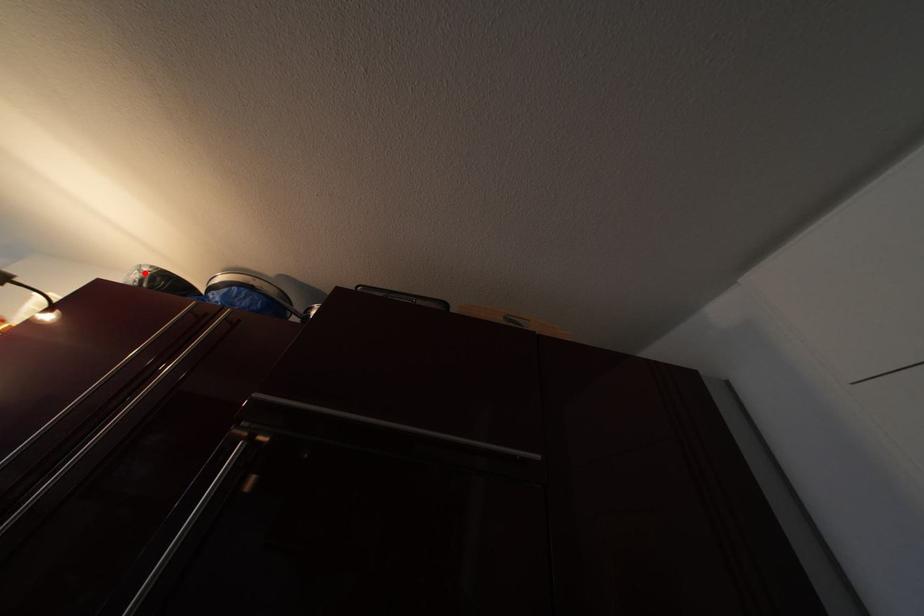
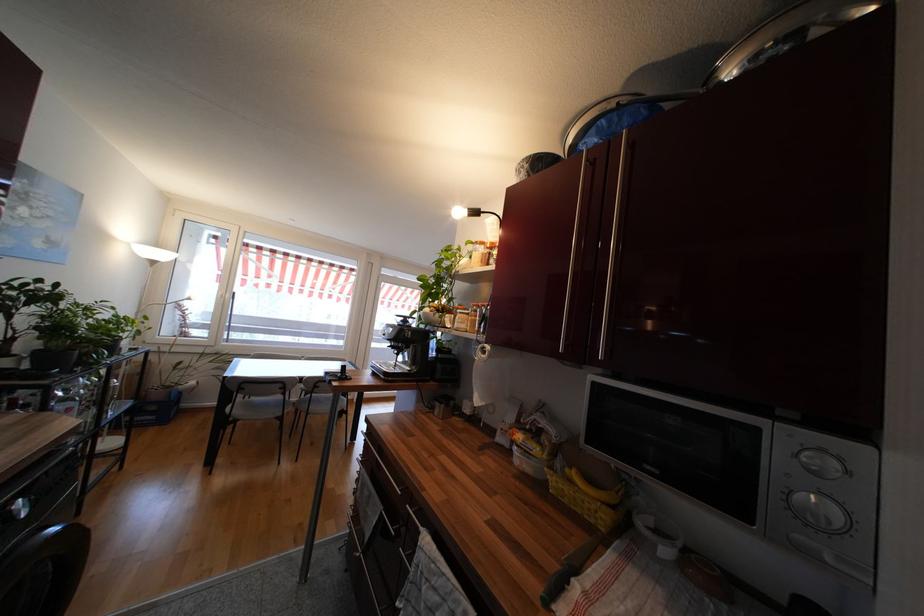
Where in the second image is the point corresponding to the highlighted location from the first image?

(527, 168)